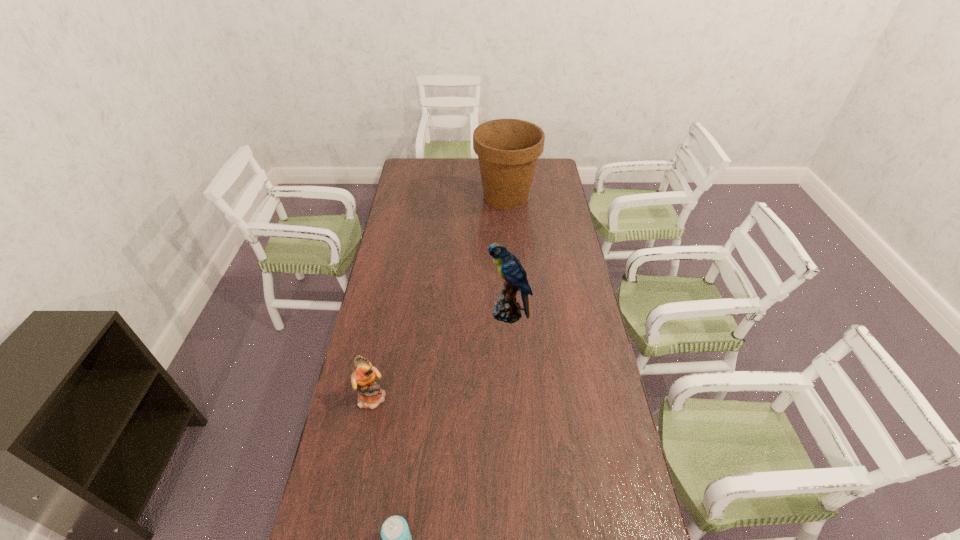
Image resolution: width=960 pixels, height=540 pixels. What are the coordinates of `object positioned at the far edge` in the screenshot? It's located at (508, 149).

This screenshot has width=960, height=540. Find the location of `object at the left edge`. object at the left edge is located at coordinates (370, 395).

Where is `object that is at the right edge`? object that is at the right edge is located at coordinates (508, 149).

This screenshot has height=540, width=960. I want to click on object that is at the far right corner, so click(x=508, y=149).

Image resolution: width=960 pixels, height=540 pixels. I want to click on vacant space at the far edge of the desktop, so click(x=452, y=176).

The height and width of the screenshot is (540, 960). I want to click on blank space at the left edge of the desktop, so click(407, 275).

Locate an element on the screen. Image resolution: width=960 pixels, height=540 pixels. free space at the right edge is located at coordinates point(587,477).

Where is `free space at the far right corner of the desktop`? The height and width of the screenshot is (540, 960). free space at the far right corner of the desktop is located at coordinates (538, 180).

Where is `free space between the shorter parrot and the taller parrot`? free space between the shorter parrot and the taller parrot is located at coordinates (441, 355).

This screenshot has width=960, height=540. I want to click on vacant point located between the left parrot and the second farthest object, so click(x=441, y=355).